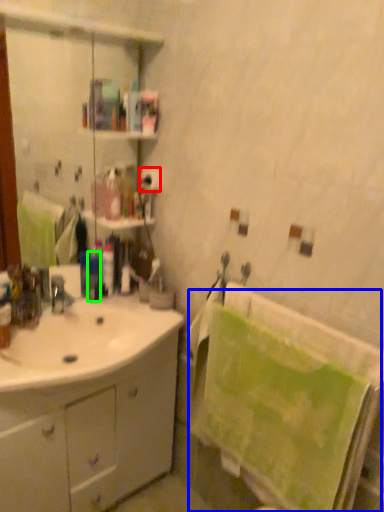
Question: Which is farther away from toilet paper (highlighted by a red box)? bath towel (highlighted by a blue box) or toiletry (highlighted by a green box)?

Choices:
 (A) bath towel
 (B) toiletry

Answer: (A)